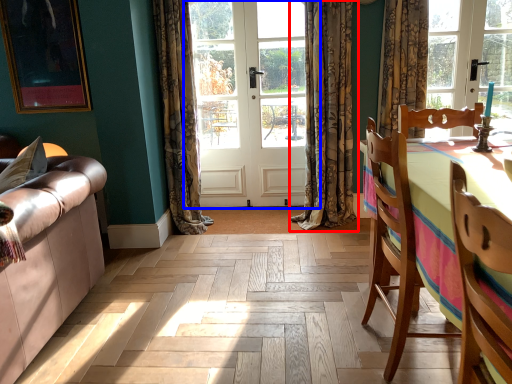
Question: Which point is further to the camera, curtain (highlighted by a red box) or door (highlighted by a blue box)?

Choices:
 (A) curtain
 (B) door

Answer: (B)